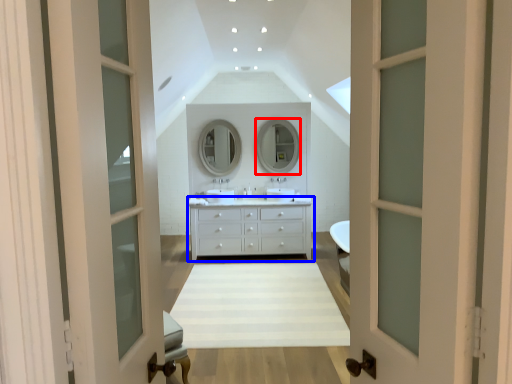
Question: Among these objects, which one is nearest to the camera, mirror (highlighted by a red box) or chest of drawers (highlighted by a blue box)?

Choices:
 (A) mirror
 (B) chest of drawers

Answer: (B)